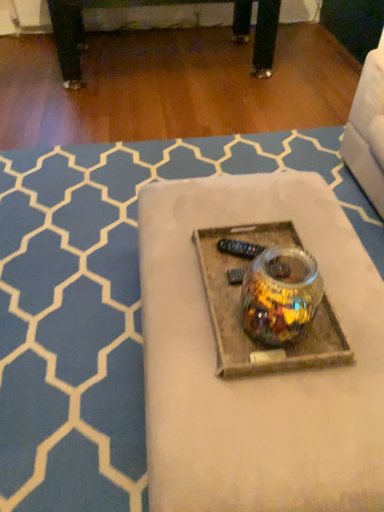
What do you see at coordinates (259, 376) in the screenshot? I see `translucent glass jar at center` at bounding box center [259, 376].

Locate an element on the screen. The height and width of the screenshot is (512, 384). translucent glass jar at center is located at coordinates (259, 376).

What is the approximate width of translucent glass jar at center?

8.75 inches.

What is the approximate height of translucent glass jar at center?

The height of translucent glass jar at center is 7.83 inches.

Where is `translucent glass jar at center`? translucent glass jar at center is located at coordinates (280, 295).

Describe the element at coordinates (280, 295) in the screenshot. I see `translucent glass jar at center` at that location.

What are the coordinates of `translucent glass jar at center` in the screenshot? It's located at [259, 376].

Considering the relative positions of translucent glass jar at center and translucent glass jar at center in the image provided, is translucent glass jar at center to the right of translucent glass jar at center from the viewer's perspective?

Incorrect, translucent glass jar at center is not on the right side of translucent glass jar at center.

Is the depth of translucent glass jar at center greater than that of translucent glass jar at center?

Yes, the depth of translucent glass jar at center is greater than that of translucent glass jar at center.

Is point (286, 415) closer to viewer compared to point (265, 302)?

Yes, point (286, 415) is closer to viewer.

From the image's perspective, would you say translucent glass jar at center is shown under translucent glass jar at center?

No.

Looking at this image, from a real-world perspective, is translucent glass jar at center physically located above or below translucent glass jar at center?

In terms of real-world spatial position, translucent glass jar at center is below translucent glass jar at center.

Considering the sizes of objects translucent glass jar at center and translucent glass jar at center in the image provided, who is thinner, translucent glass jar at center or translucent glass jar at center?

translucent glass jar at center.

Considering the sizes of translucent glass jar at center and translucent glass jar at center in the image, is translucent glass jar at center taller or shorter than translucent glass jar at center?

Considering their sizes, translucent glass jar at center has less height than translucent glass jar at center.

Can you confirm if translucent glass jar at center is smaller than translucent glass jar at center?

Incorrect, translucent glass jar at center is not smaller in size than translucent glass jar at center.

Is translucent glass jar at center surrounding translucent glass jar at center?

Definitely not — translucent glass jar at center is not inside translucent glass jar at center.

Is translucent glass jar at center not close to translucent glass jar at center?

They are positioned close to each other.

Is translucent glass jar at center facing away from translucent glass jar at center?

No, translucent glass jar at center is not at the back of translucent glass jar at center.

What's the angular difference between translucent glass jar at center and translucent glass jar at center's facing directions?

179 degrees separate the facing orientations of translucent glass jar at center and translucent glass jar at center.

Measure the distance between translucent glass jar at center and translucent glass jar at center.

The distance of translucent glass jar at center from translucent glass jar at center is 7.16 inches.

Locate an element on the screen. glass jar below the translucent glass jar at center (from the image's perspective) is located at coordinates (280, 295).

Considering the positions of objects translucent glass jar at center and translucent glass jar at center in the image provided, who is more to the right, translucent glass jar at center or translucent glass jar at center?

From the viewer's perspective, translucent glass jar at center appears more on the right side.

Between translucent glass jar at center and translucent glass jar at center, which one is positioned behind?

translucent glass jar at center is more distant.

Between point (292, 298) and point (372, 492), which one is positioned in front?

The point (372, 492) is more forward.

From the image's perspective, is translucent glass jar at center on translucent glass jar at center?

Actually, translucent glass jar at center appears below translucent glass jar at center in the image.

From a real-world perspective, which is physically above, translucent glass jar at center or translucent glass jar at center?

translucent glass jar at center.

Can you confirm if translucent glass jar at center is thinner than translucent glass jar at center?

Indeed, translucent glass jar at center has a lesser width compared to translucent glass jar at center.

In terms of height, does translucent glass jar at center look taller or shorter compared to translucent glass jar at center?

Clearly, translucent glass jar at center is taller compared to translucent glass jar at center.

Which of these two, translucent glass jar at center or translucent glass jar at center, is bigger?

Bigger between the two is translucent glass jar at center.

Would you say translucent glass jar at center is part of translucent glass jar at center's contents?

No.

Can you see translucent glass jar at center touching translucent glass jar at center?

No.

Is translucent glass jar at center oriented towards translucent glass jar at center?

No, translucent glass jar at center is not turned towards translucent glass jar at center.

Can you tell me how much translucent glass jar at center and translucent glass jar at center differ in facing direction?

179 degrees separate the facing orientations of translucent glass jar at center and translucent glass jar at center.

The height and width of the screenshot is (512, 384). I want to click on glass jar below the translucent glass jar at center (from the image's perspective), so click(280, 295).

Image resolution: width=384 pixels, height=512 pixels. What are the coordinates of `table behind the translucent glass jar at center` in the screenshot? It's located at click(x=259, y=376).

At what (x,y) coordinates should I click in order to perform the action: click on table located on the left of translucent glass jar at center. Please return your answer as a coordinate pair (x, y). Image resolution: width=384 pixels, height=512 pixels. Looking at the image, I should click on (259, 376).